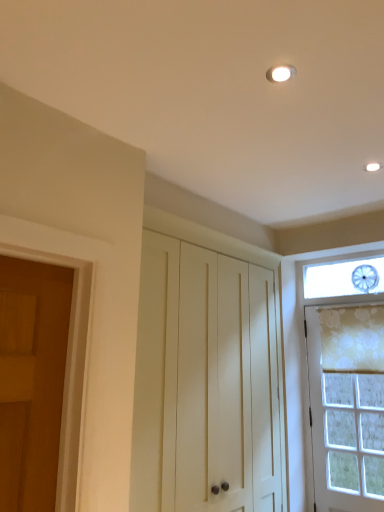
Question: Visually, is white wood cabinet at center positioned to the left or to the right of floral fabric curtain at right?

Choices:
 (A) right
 (B) left

Answer: (B)

Question: Considering their positions, is white wood cabinet at center located in front of or behind floral fabric curtain at right?

Choices:
 (A) behind
 (B) front

Answer: (B)

Question: Which object is positioned closest to the floral fabric curtain at right?

Choices:
 (A) white textured door at right
 (B) white wood cabinet at center

Answer: (A)

Question: Estimate the real-world distances between objects in this image. Which object is farther from the white wood cabinet at center?

Choices:
 (A) white textured door at right
 (B) floral fabric curtain at right

Answer: (B)